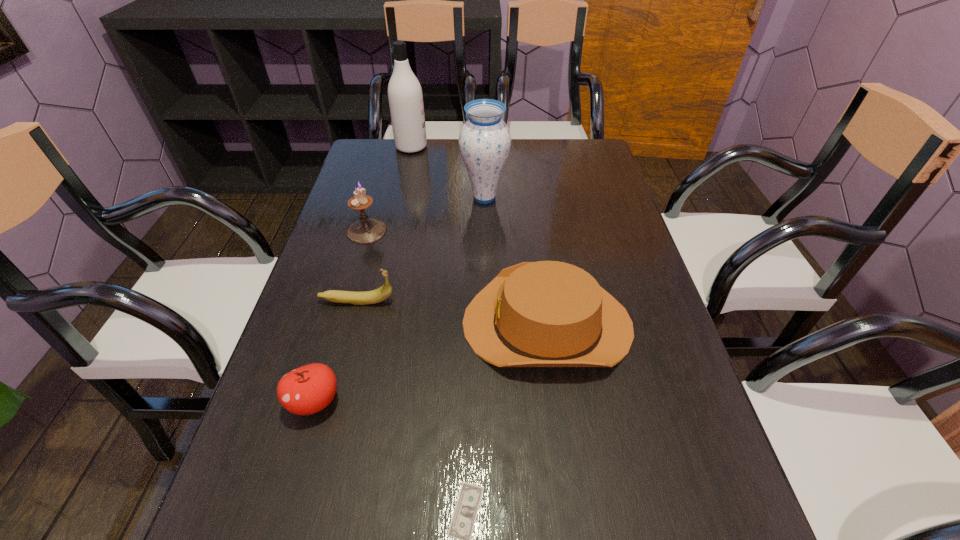
Where is `free spot that satisfies the following two spatial constraints: 1. on the back side of the fifth shortest object; 2. on the right side of the second nearest object`? The width and height of the screenshot is (960, 540). free spot that satisfies the following two spatial constraints: 1. on the back side of the fifth shortest object; 2. on the right side of the second nearest object is located at coordinates (365, 231).